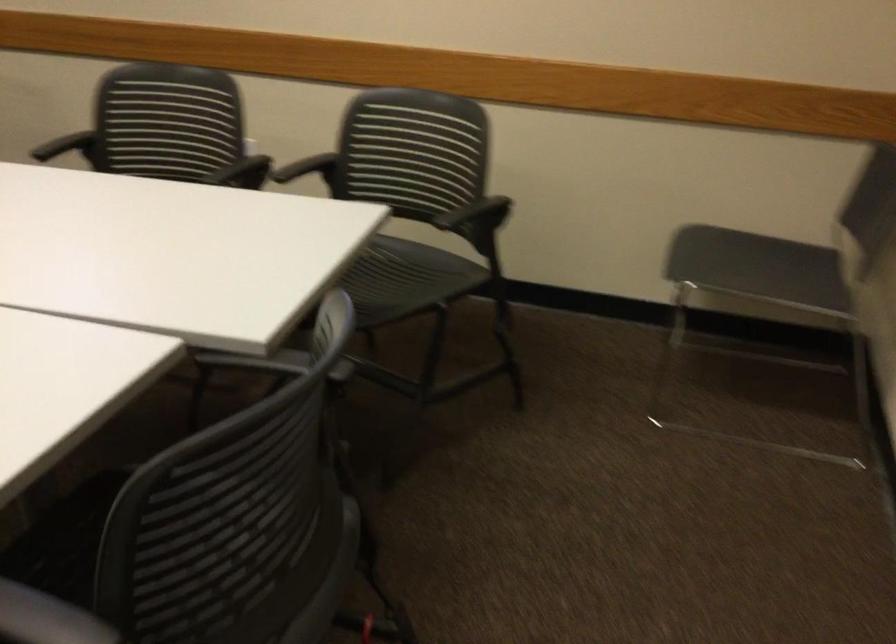
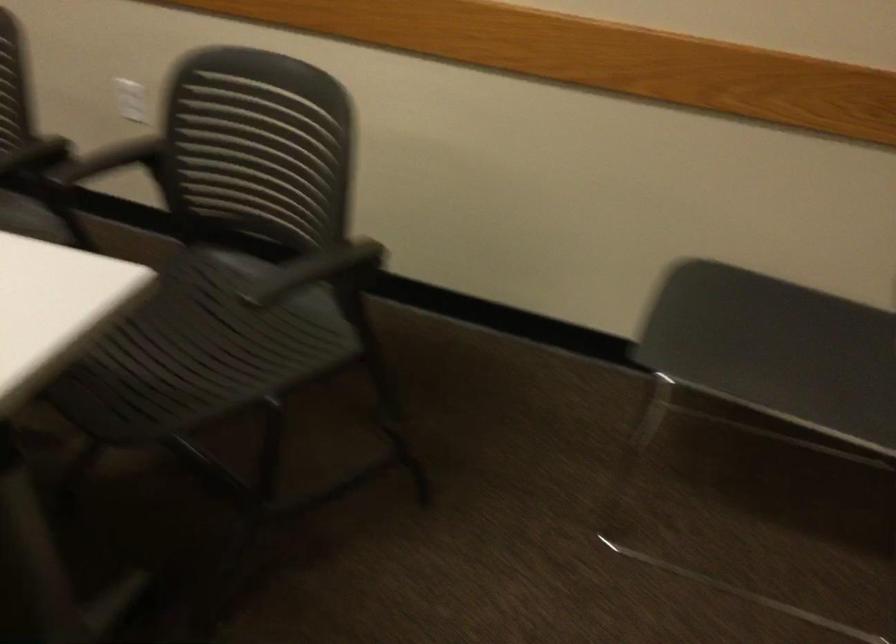
Question: The images are taken continuously from a first-person perspective. In which direction is your viewpoint rotating?

Choices:
 (A) Left
 (B) Right
 (C) Up
 (D) Down

Answer: (D)